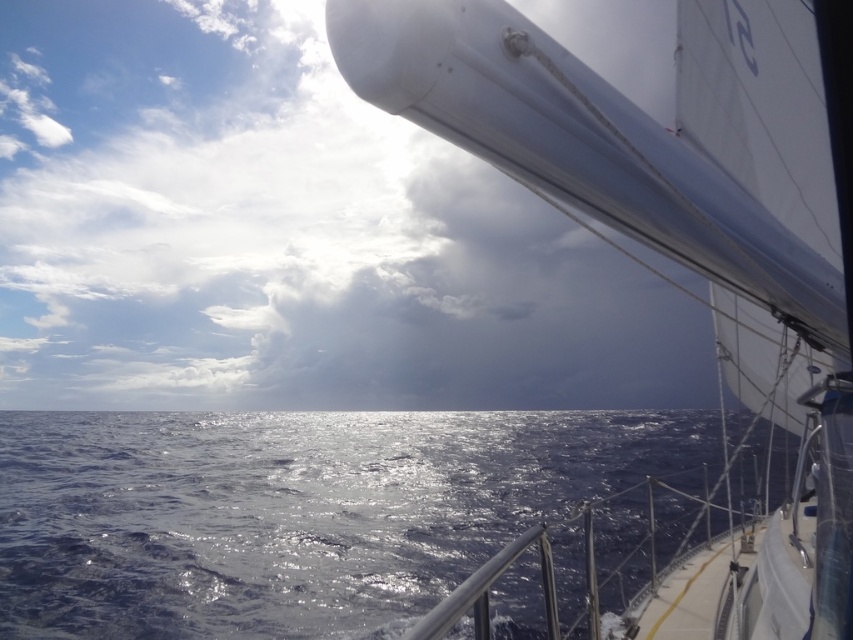
Question: Which point is closer to the camera?

Choices:
 (A) white glossy sailboat at upper right
 (B) glistening blue water at center

Answer: (A)

Question: Does white glossy sailboat at upper right have a larger size compared to glistening blue water at center?

Choices:
 (A) yes
 (B) no

Answer: (B)

Question: Considering the relative positions of white glossy sailboat at upper right and glistening blue water at center in the image provided, where is white glossy sailboat at upper right located with respect to glistening blue water at center?

Choices:
 (A) left
 (B) right

Answer: (B)

Question: Is white glossy sailboat at upper right thinner than glistening blue water at center?

Choices:
 (A) yes
 (B) no

Answer: (A)